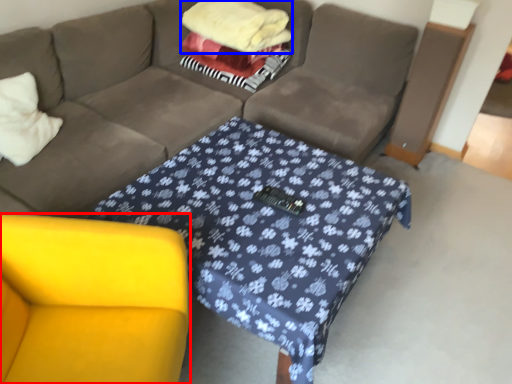
Question: Which object is further to the camera taking this photo, armchair (highlighted by a red box) or blanket (highlighted by a blue box)?

Choices:
 (A) armchair
 (B) blanket

Answer: (B)